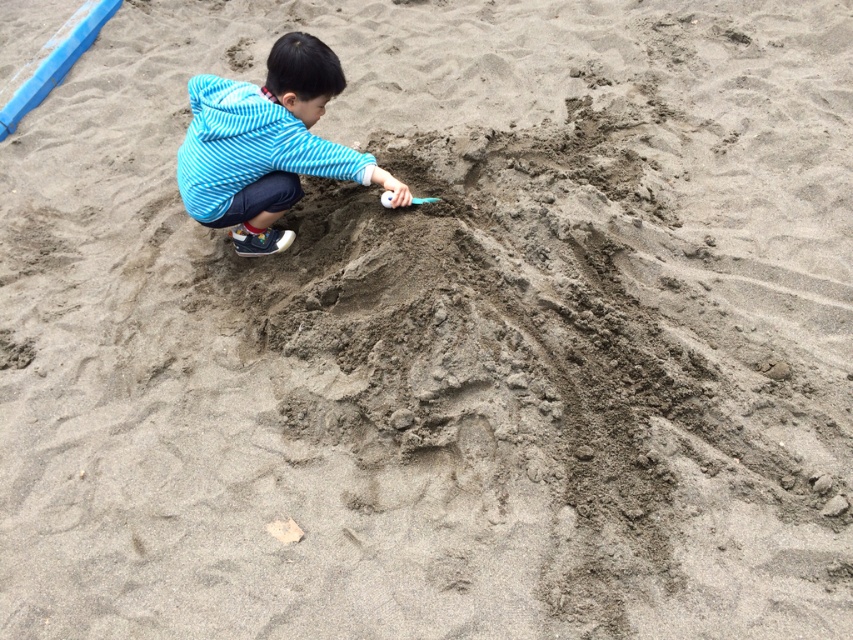
You are a photographer trying to capture the child and the smooth plastic shovel at center. The blue striped hoodie at upper left is blocking your view. Can you move closer to the child to get a clear shot of the shovel without the hoodie in the frame?

The blue striped hoodie at upper left is closer to the viewer than the smooth plastic shovel at center, so moving closer to the child might not eliminate the hoodie from the frame. You would need to adjust your angle or position to ensure the hoodie is no longer obstructing the view of the shovel.

You are a parent watching your child play at the beach. You have a toy that is the same size as the smooth plastic shovel at center. Can you estimate if the blue striped hoodie at upper left can fit into a box designed to hold items taller than the shovel?

The blue striped hoodie at upper left is taller than the smooth plastic shovel at center. Since the box is designed for items taller than the shovel, the hoodie would fit into the box.

You are a photographer trying to capture the child and their tools in the scene. Since the blue striped hoodie at upper left and the smooth plastic shovel at center are both in view, which object should you focus on to ensure both are clearly visible in the photo?

The blue striped hoodie at upper left is larger in size than the smooth plastic shovel at center, so focusing on the blue striped hoodie at upper left will ensure both objects are clearly visible in the photo.